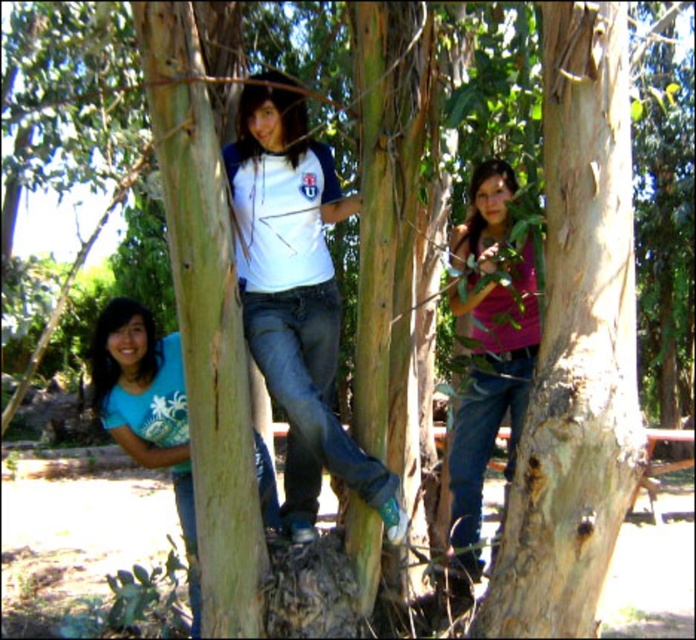
Consider the image. In the scene, there are two items of clothing visible. The pink matte shirt at center and the blue denim jeans at lower left. Which of these two items appears bigger in the image?

The pink matte shirt at center is larger in size than the blue denim jeans at lower left, so the pink matte shirt at center appears bigger in the image.

You are standing in the outdoor area and see the pink matte shirt at center and the blue denim jeans at lower left. Which one is positioned more to the right?

The pink matte shirt at center is positioned to the right of the blue denim jeans at lower left, so the pink matte shirt at center is more to the right.

In the scene shown: You are a photographer trying to capture a photo of the pink matte shirt at center and the blue denim jeans at lower left. Which object should you focus on first to ensure both are in sharp focus?

The pink matte shirt at center is closer to the viewer than the blue denim jeans at lower left. To ensure both are in sharp focus, you should focus on the pink matte shirt at center first, as it is closer, and the depth of field may naturally include the farther object.